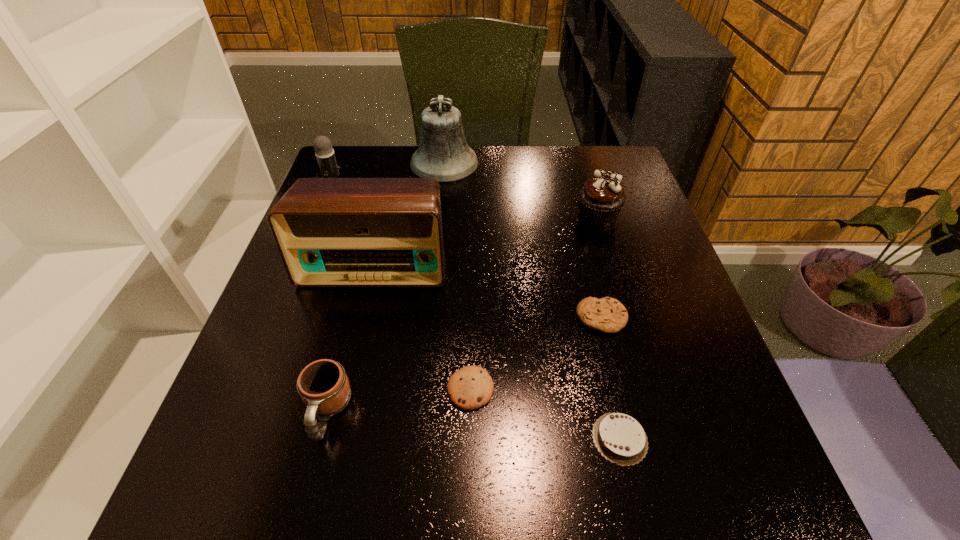
Where is `vacant area at the far edge`? Image resolution: width=960 pixels, height=540 pixels. vacant area at the far edge is located at coordinates (562, 173).

In the image, there is a desktop. Identify the location of vacant space at the near edge. This screenshot has width=960, height=540. (634, 487).

Image resolution: width=960 pixels, height=540 pixels. Find the location of `free location at the left edge of the desktop`. free location at the left edge of the desktop is located at coordinates (295, 421).

In the image, there is a desktop. At what (x,y) coordinates should I click in order to perform the action: click on vacant space at the right edge. Please return your answer as a coordinate pair (x, y). Image resolution: width=960 pixels, height=540 pixels. Looking at the image, I should click on (626, 361).

Identify the location of free space at the near right corner. The width and height of the screenshot is (960, 540). tap(681, 469).

The height and width of the screenshot is (540, 960). Identify the location of vacant area that lies between the farther cookie and the third tallest object. (468, 255).

You are a GUI agent. You are given a task and a screenshot of the screen. Output one action in this format:
    pyautogui.click(x=<x>, y=<y>)
    Task: Click on the free spot between the fourth shortest object and the radio receiver
    The width and height of the screenshot is (960, 540).
    Given the screenshot: What is the action you would take?
    pyautogui.click(x=351, y=338)

I want to click on free space between the cupcake and the fifth farthest object, so click(599, 267).

Where is `vacant area that lies between the bell and the fifth tallest object`? vacant area that lies between the bell and the fifth tallest object is located at coordinates (386, 287).

At what (x,y) coordinates should I click in order to perform the action: click on free space between the bell and the cupcake. Please return your answer as a coordinate pair (x, y). The height and width of the screenshot is (540, 960). Looking at the image, I should click on (521, 190).